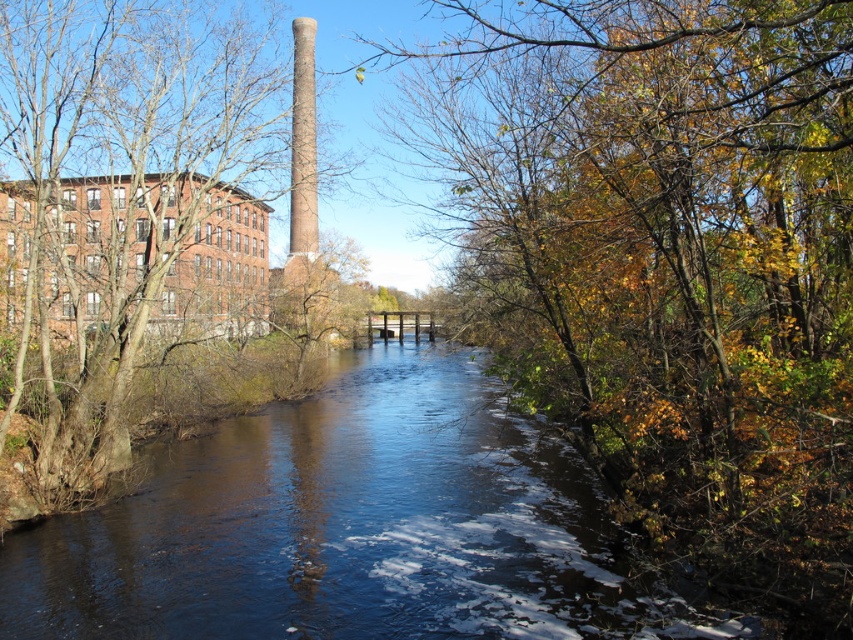
Question: Can you confirm if autumn leaves at center is bigger than smooth bark tree at left?

Choices:
 (A) yes
 (B) no

Answer: (B)

Question: Does autumn leaves at center appear on the left side of smooth bark tree at left?

Choices:
 (A) no
 (B) yes

Answer: (A)

Question: Which object is farther from the camera taking this photo?

Choices:
 (A) autumn leaves at center
 (B) smooth bark tree at left

Answer: (B)

Question: Does autumn leaves at center have a lesser width compared to smooth bark tree at left?

Choices:
 (A) no
 (B) yes

Answer: (B)